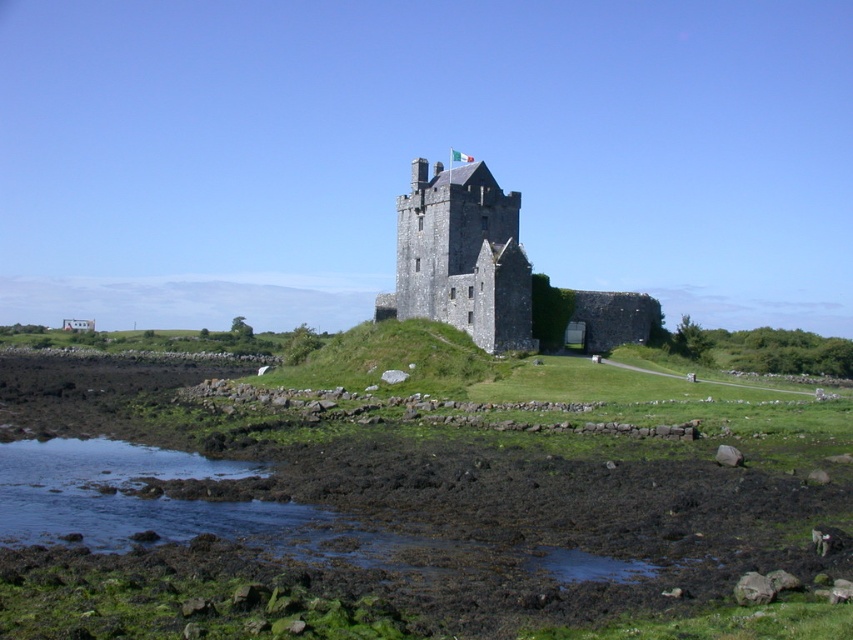
You are standing at the point marked by point (462, 257) in the image. What is the main structure you are facing?

The point (462, 257) marks the dark gray stone castle at center, so the main structure you are facing is the dark gray stone castle at center.

You are a tourist standing on the rocky shoreline looking at the dark gray stone castle at center. You notice the black mud at lower left. Which object is larger in size?

The dark gray stone castle at center is larger than the black mud at lower left.